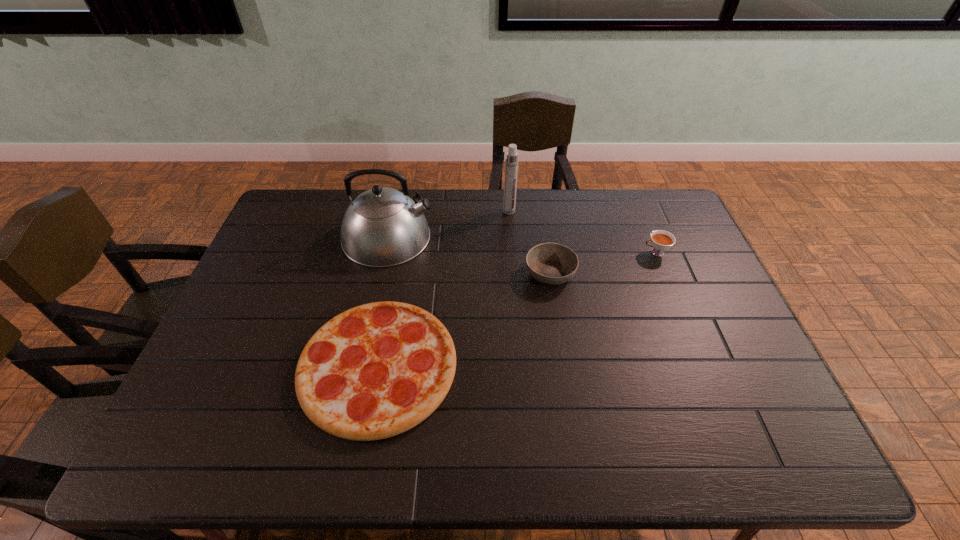
Where is `vacant space that's between the bowl and the shortest object`? The image size is (960, 540). vacant space that's between the bowl and the shortest object is located at coordinates (465, 320).

You are a GUI agent. You are given a task and a screenshot of the screen. Output one action in this format:
    pyautogui.click(x=<x>, y=<y>)
    Task: Click on the vacant region between the teacup and the pizza
    The image size is (960, 540).
    Given the screenshot: What is the action you would take?
    pyautogui.click(x=517, y=310)

Select which object appears as the closest to the third object from right to left. Please provide its 2D coordinates. Your answer should be formatted as a tuple, i.e. [(x, y)], where the tuple contains the x and y coordinates of a point satisfying the conditions above.

[(549, 263)]

This screenshot has width=960, height=540. What are the coordinates of `object that stands as the third closest to the teacup` in the screenshot? It's located at (374, 371).

Find the location of a particular element. The image size is (960, 540). vacant position in the image that satisfies the following two spatial constraints: 1. on the front side of the aerosol can; 2. on the right side of the fourth object from left to right is located at coordinates (514, 274).

Identify the location of free location that satisfies the following two spatial constraints: 1. on the side of the teacup with the handle; 2. on the front side of the bowl. (664, 274).

Find the location of a particular element. This screenshot has height=540, width=960. vacant space that satisfies the following two spatial constraints: 1. from the spout of the bowl; 2. on the right side of the kettle is located at coordinates point(380,274).